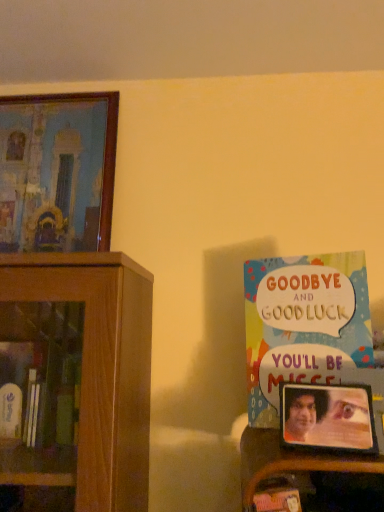
Question: From a real-world perspective, is metallic silver photo frame at right, the second picture frame from the top, below wooden framed painting at upper left, marked as the second picture frame in a right-to-left arrangement?

Choices:
 (A) no
 (B) yes

Answer: (B)

Question: Does metallic silver photo frame at right, the 2th picture frame positioned from the left, have a lesser height compared to wooden framed painting at upper left, marked as the 1th picture frame in a left-to-right arrangement?

Choices:
 (A) no
 (B) yes

Answer: (B)

Question: Is metallic silver photo frame at right, the first picture frame from the bottom, surrounding wooden framed painting at upper left, marked as the second picture frame in a right-to-left arrangement?

Choices:
 (A) yes
 (B) no

Answer: (B)

Question: Would you consider metallic silver photo frame at right, positioned as the 1th picture frame in right-to-left order, to be distant from wooden framed painting at upper left, marked as the 1th picture frame in a left-to-right arrangement?

Choices:
 (A) no
 (B) yes

Answer: (A)

Question: Does metallic silver photo frame at right, the first picture frame positioned from the front, lie in front of wooden framed painting at upper left, acting as the 2th picture frame starting from the front?

Choices:
 (A) yes
 (B) no

Answer: (A)

Question: In the image, is wooden framed painting at upper left, acting as the 2th picture frame starting from the front, on the left side or the right side of multicolored paper book at right?

Choices:
 (A) right
 (B) left

Answer: (B)

Question: Is wooden framed painting at upper left, placed as the first picture frame when sorted from top to bottom, bigger or smaller than multicolored paper book at right?

Choices:
 (A) big
 (B) small

Answer: (A)

Question: Choose the correct answer: Is wooden framed painting at upper left, the first picture frame when ordered from back to front, inside multicolored paper book at right or outside it?

Choices:
 (A) outside
 (B) inside

Answer: (A)

Question: Does point (44, 138) appear closer or farther from the camera than point (274, 282)?

Choices:
 (A) closer
 (B) farther

Answer: (B)

Question: Is metallic silver photo frame at right, positioned as the 1th picture frame in right-to-left order, taller or shorter than multicolored paper book at right?

Choices:
 (A) short
 (B) tall

Answer: (A)

Question: Considering the positions of metallic silver photo frame at right, the first picture frame from the bottom, and multicolored paper book at right in the image, is metallic silver photo frame at right, the first picture frame from the bottom, bigger or smaller than multicolored paper book at right?

Choices:
 (A) big
 (B) small

Answer: (B)

Question: Is metallic silver photo frame at right, the second picture frame from the top, wider or thinner than multicolored paper book at right?

Choices:
 (A) wide
 (B) thin

Answer: (A)

Question: From the image's perspective, is metallic silver photo frame at right, positioned as the 1th picture frame in right-to-left order, located above or below multicolored paper book at right?

Choices:
 (A) above
 (B) below

Answer: (B)

Question: Looking at the image, does metallic silver photo frame at right, the second picture frame in the back-to-front sequence, seem bigger or smaller compared to wooden framed painting at upper left, acting as the 2th picture frame starting from the front?

Choices:
 (A) small
 (B) big

Answer: (A)

Question: Considering the positions of metallic silver photo frame at right, positioned as the 1th picture frame in right-to-left order, and wooden framed painting at upper left, placed as the first picture frame when sorted from top to bottom, in the image, is metallic silver photo frame at right, positioned as the 1th picture frame in right-to-left order, wider or thinner than wooden framed painting at upper left, placed as the first picture frame when sorted from top to bottom,?

Choices:
 (A) wide
 (B) thin

Answer: (B)